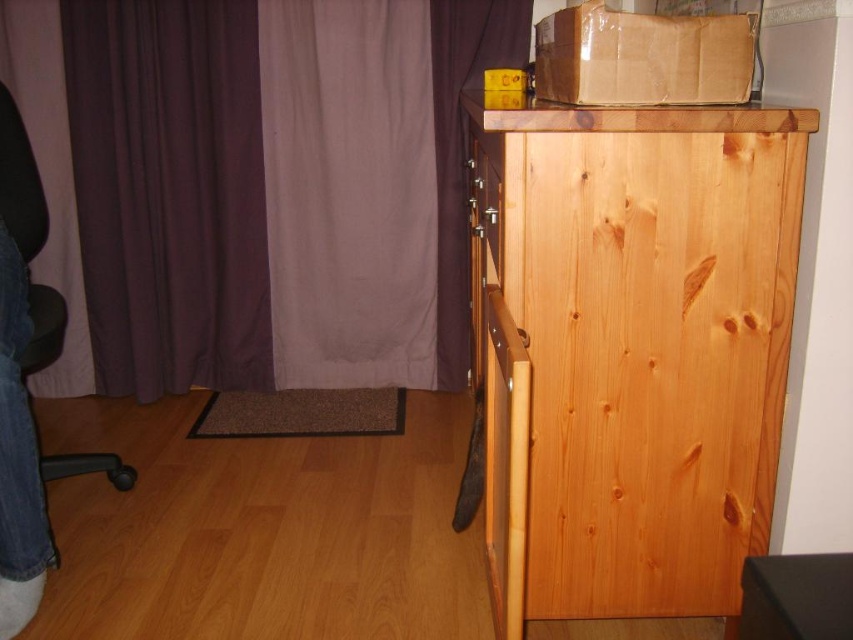
Question: Can you confirm if purple fabric curtain at upper left is bigger than black mesh chair at left?

Choices:
 (A) yes
 (B) no

Answer: (A)

Question: Among these points, which one is nearest to the camera?

Choices:
 (A) (24, 284)
 (B) (22, 122)

Answer: (A)

Question: Can you confirm if purple fabric curtain at upper left is positioned to the left of denim jeans at lower left?

Choices:
 (A) yes
 (B) no

Answer: (A)

Question: Can you confirm if natural wood dresser at upper right is positioned above purple fabric curtain at upper left?

Choices:
 (A) yes
 (B) no

Answer: (B)

Question: Which point is closer to the camera?

Choices:
 (A) natural wood dresser at upper right
 (B) purple fabric curtain at upper left

Answer: (A)

Question: Which point appears closest to the camera in this image?

Choices:
 (A) (613, 196)
 (B) (154, 72)
 (C) (38, 572)
 (D) (64, 307)

Answer: (A)